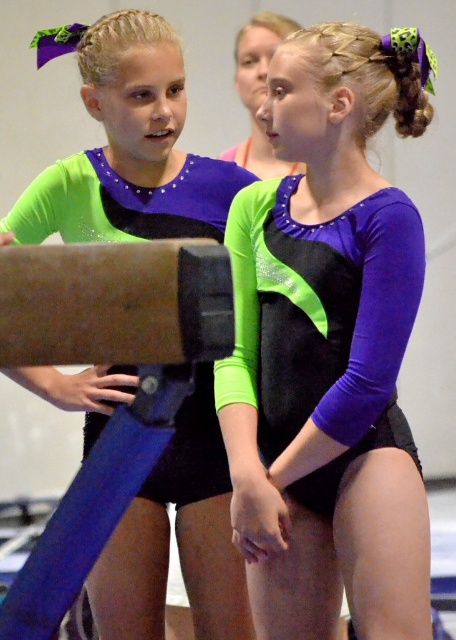
You are a coach observing two gymnasts wearing the purple matte leotard at center and the matte black leotard at center. Which leotard has a larger size?

The purple matte leotard at center is bigger than the matte black leotard at center, so the purple one is larger in size.